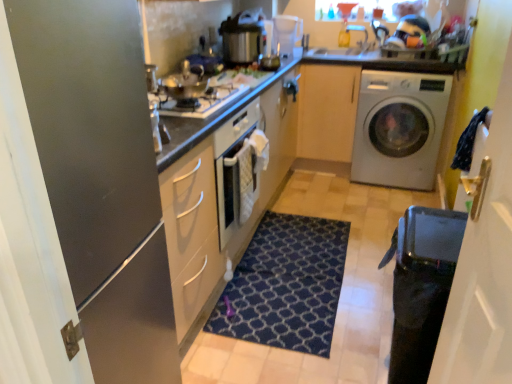
Question: Considering the relative positions of transparent plastic coffee machine at upper center and transparent glass door at right, the 2th glass door in the left-to-right sequence, in the image provided, is transparent plastic coffee machine at upper center to the left or to the right of transparent glass door at right, the 2th glass door in the left-to-right sequence,?

Choices:
 (A) left
 (B) right

Answer: (A)

Question: Considering the positions of point (286, 19) and point (501, 370), is point (286, 19) closer or farther from the camera than point (501, 370)?

Choices:
 (A) closer
 (B) farther

Answer: (B)

Question: Based on their relative distances, which object is farther from the matte black refrigerator at left, arranged as the first glass door when viewed from the left?

Choices:
 (A) transparent plastic coffee machine at upper center
 (B) light wood cabinet at center
 (C) transparent glass door at right, the 2th glass door in the left-to-right sequence
 (D) matte white oven at center
 (E) white glossy washing machine at right

Answer: (E)

Question: Considering the real-world distances, which object is closest to the dark blue textured rug at center?

Choices:
 (A) transparent plastic coffee machine at upper center
 (B) light wood cabinet at center
 (C) metallic pressure cooker at upper center
 (D) matte black refrigerator at left, which appears as the 2th glass door when viewed from the right
 (E) transparent glass door at right, which is counted as the 1th glass door, starting from the right

Answer: (E)